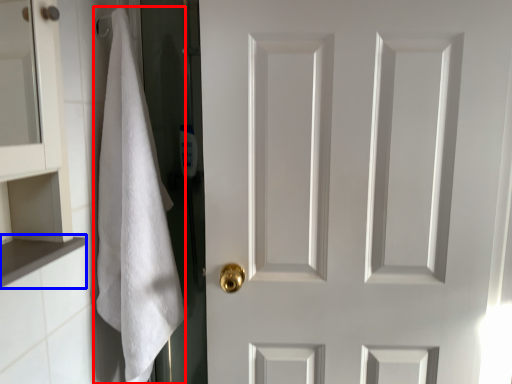
Question: Which point is closer to the camera, bath towel (highlighted by a red box) or cabinet (highlighted by a blue box)?

Choices:
 (A) bath towel
 (B) cabinet

Answer: (B)